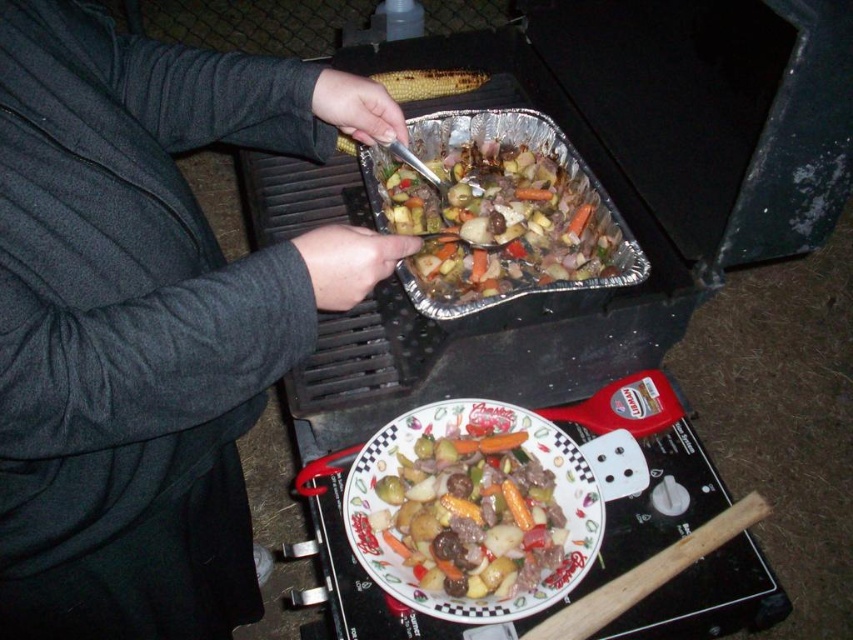
Consider the image. Which is above, dark gray sweater at upper left or grilled yellow corn at upper center?

grilled yellow corn at upper center is above.

This screenshot has width=853, height=640. What do you see at coordinates (148, 317) in the screenshot?
I see `dark gray sweater at upper left` at bounding box center [148, 317].

Is point (229, 353) closer to viewer compared to point (421, 97)?

Yes, point (229, 353) is closer to viewer.

Where is `dark gray sweater at upper left`? This screenshot has width=853, height=640. dark gray sweater at upper left is located at coordinates (148, 317).

Which of these two, dark gray sweater at upper left or shiny aluminum foil at center, stands shorter?

Standing shorter between the two is shiny aluminum foil at center.

How far apart are dark gray sweater at upper left and shiny aluminum foil at center?

dark gray sweater at upper left is 12.24 inches away from shiny aluminum foil at center.

The width and height of the screenshot is (853, 640). Describe the element at coordinates (148, 317) in the screenshot. I see `dark gray sweater at upper left` at that location.

Locate an element on the screen. dark gray sweater at upper left is located at coordinates (148, 317).

Describe the element at coordinates (497, 218) in the screenshot. I see `shiny aluminum foil at center` at that location.

Is shiny aluminum foil at center above decorative ceramic plate at center?

Indeed, shiny aluminum foil at center is positioned over decorative ceramic plate at center.

Based on the photo, measure the distance between point [438,168] and camera.

They are 4.02 feet apart.

Where is `shiny aluminum foil at center`? The height and width of the screenshot is (640, 853). shiny aluminum foil at center is located at coordinates (497, 218).